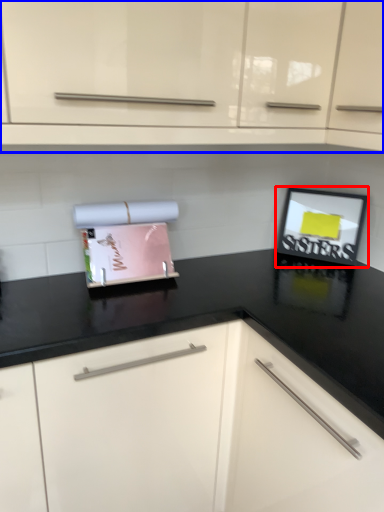
Question: Which point is further to the camera, picture frame (highlighted by a red box) or cabinetry (highlighted by a blue box)?

Choices:
 (A) picture frame
 (B) cabinetry

Answer: (A)